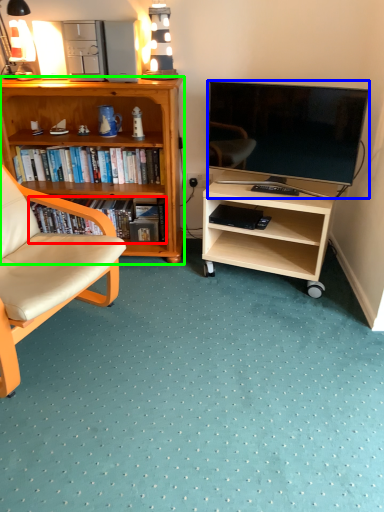
Question: Which is nearer to the book (highlighted by a red box)? television (highlighted by a blue box) or desk (highlighted by a green box).

Choices:
 (A) television
 (B) desk

Answer: (B)